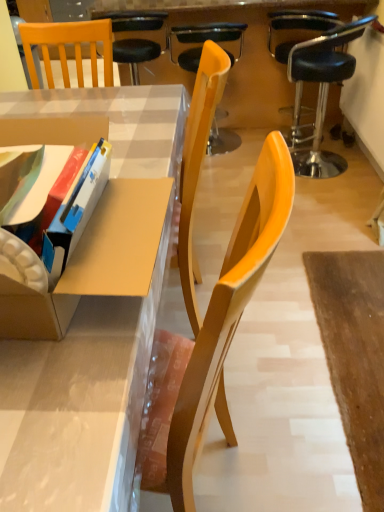
Question: Considering their positions, is matte plastic desk at center located in front of or behind cardboard box at left?

Choices:
 (A) front
 (B) behind

Answer: (A)

Question: In terms of size, does matte plastic desk at center appear bigger or smaller than cardboard box at left?

Choices:
 (A) big
 (B) small

Answer: (A)

Question: Estimate the real-world distances between objects in this image. Which object is farther from the wooden chair at center, which is the second chair in left-to-right order?

Choices:
 (A) black leather stool at upper right, the third chair viewed from the left
 (B) wooden chair at upper left, the 3th chair when ordered from right to left
 (C) cardboard box at left
 (D) matte plastic desk at center

Answer: (C)

Question: Which is nearer to the wooden chair at center, the 2th chair positioned from the right?

Choices:
 (A) matte plastic desk at center
 (B) wooden chair at upper left, the first chair viewed from the left
 (C) black leather stool at upper right, the third chair viewed from the left
 (D) cardboard box at left

Answer: (B)